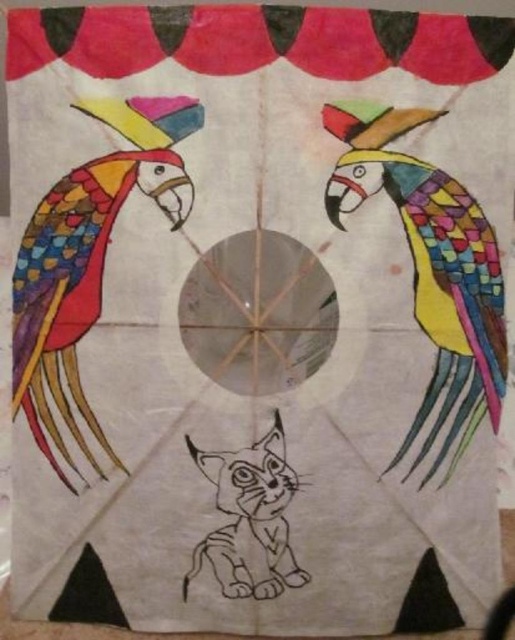
Does multicolored mosaic parrot at center appear on the right side of multicolored paper parrot at left?

Indeed, multicolored mosaic parrot at center is positioned on the right side of multicolored paper parrot at left.

This screenshot has width=515, height=640. In order to click on multicolored mosaic parrot at center in this screenshot , I will do `click(432, 272)`.